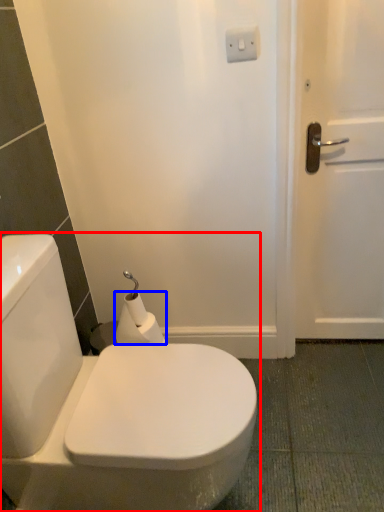
Question: Which point is closer to the camera, toilet (highlighted by a red box) or toilet paper (highlighted by a blue box)?

Choices:
 (A) toilet
 (B) toilet paper

Answer: (A)